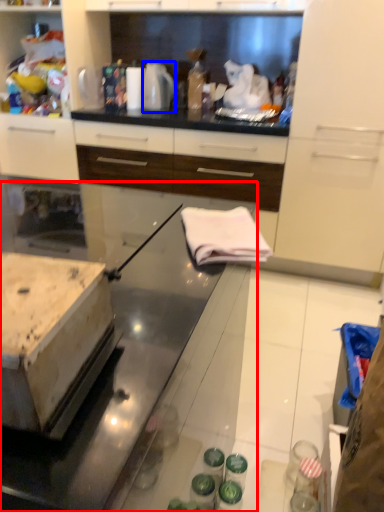
Question: Which point is closer to the camera, countertop (highlighted by a red box) or kitchen appliance (highlighted by a blue box)?

Choices:
 (A) countertop
 (B) kitchen appliance

Answer: (A)